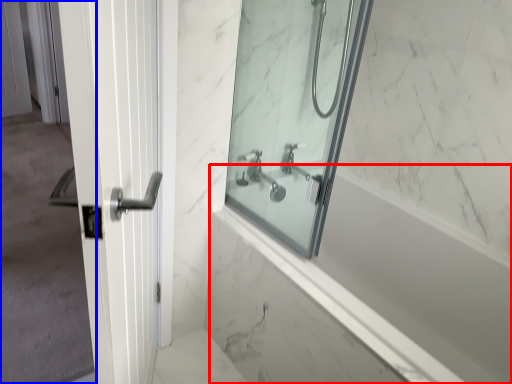
Question: Which of the following is the farthest to the observer, bath (highlighted by a red box) or screen door (highlighted by a blue box)?

Choices:
 (A) bath
 (B) screen door

Answer: (A)